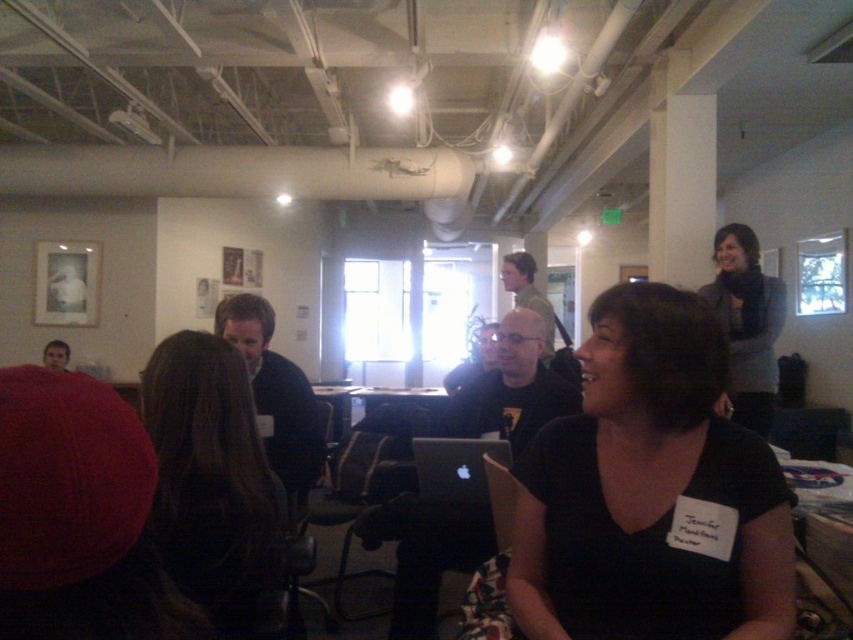
Question: Can you confirm if dark brown hair at center is thinner than gray wool sweater at upper right?

Choices:
 (A) no
 (B) yes

Answer: (B)

Question: Which of the following is the farthest from the observer?

Choices:
 (A) (772, 394)
 (B) (451, 458)
 (C) (596, 628)

Answer: (A)

Question: Does dark brown hair at center have a larger size compared to gray wool sweater at upper right?

Choices:
 (A) yes
 (B) no

Answer: (B)

Question: Is dark brown hair at center behind black matte laptop at center?

Choices:
 (A) yes
 (B) no

Answer: (B)

Question: Which object is positioned closest to the dark brown hair at center?

Choices:
 (A) black matte laptop at center
 (B) gray wool sweater at upper right

Answer: (A)

Question: Which of the following is the closest to the observer?

Choices:
 (A) (422, 476)
 (B) (546, 573)

Answer: (B)